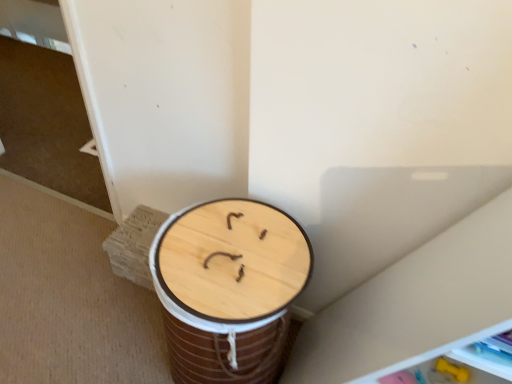
What are the coordinates of `vacant area to the left of light wood/texture barrel at center` in the screenshot? It's located at (117, 333).